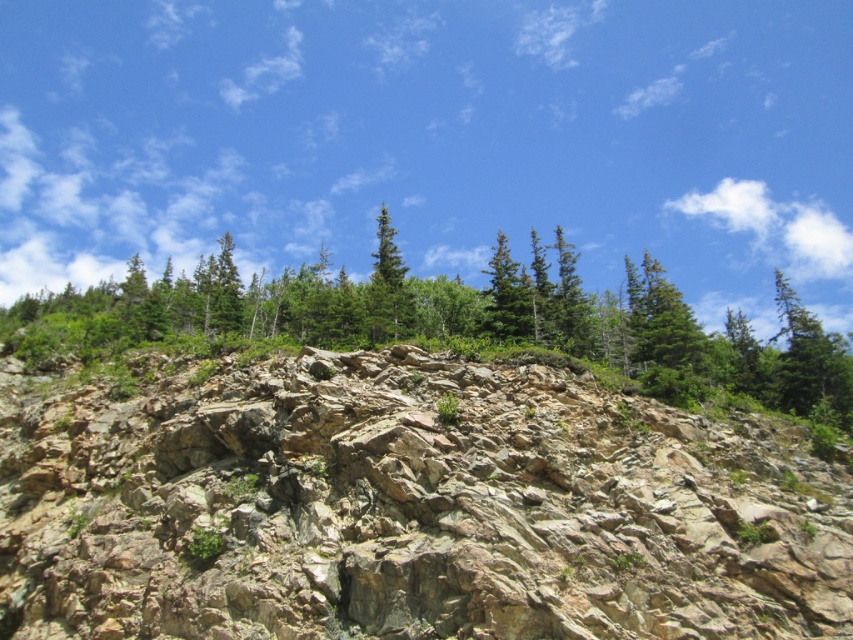
Question: Does green textured trees at upper center appear on the right side of green matte tree at center?

Choices:
 (A) no
 (B) yes

Answer: (B)

Question: Which object appears closest to the camera in this image?

Choices:
 (A) green textured trees at upper center
 (B) rocky terrain at center
 (C) green matte tree at center

Answer: (B)

Question: Which point is farther to the camera?

Choices:
 (A) (387, 296)
 (B) (815, 392)
 (C) (310, 380)

Answer: (A)

Question: Is rocky terrain at center thinner than green textured trees at upper center?

Choices:
 (A) no
 (B) yes

Answer: (B)

Question: Does rocky terrain at center have a larger size compared to green matte tree at center?

Choices:
 (A) no
 (B) yes

Answer: (A)

Question: Among these objects, which one is nearest to the camera?

Choices:
 (A) green matte tree at center
 (B) green textured trees at upper center
 (C) rocky terrain at center

Answer: (C)